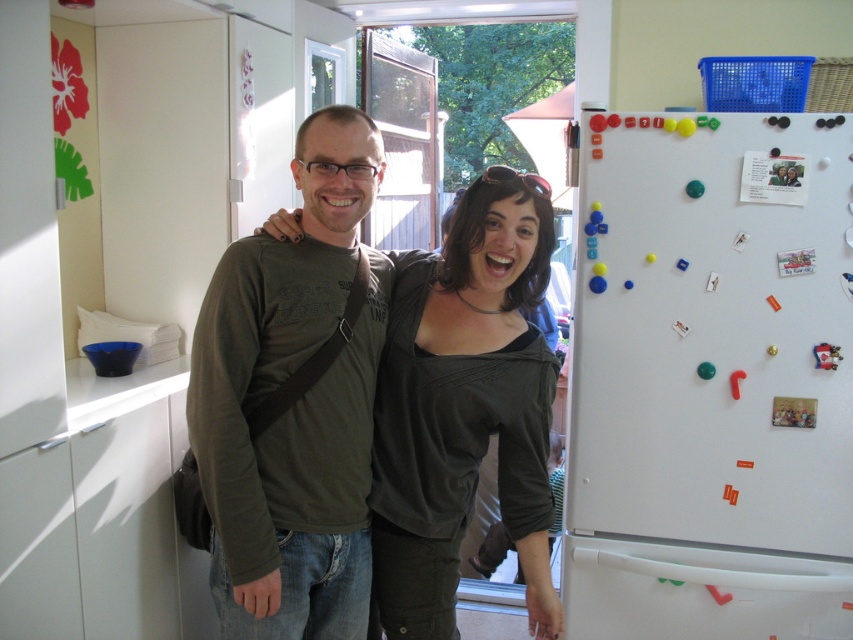
You are trying to locate the white matte refrigerator at right in the kitchen scene. According to the description, where is it positioned relative to the matte olive green shirt at center?

The white matte refrigerator at right is located to the right of the matte olive green shirt at center.

You are trying to locate the matte olive green shirt at center in the kitchen scene. According to the coordinates provided, where exactly is it positioned?

The matte olive green shirt at center is positioned at coordinates point (291,403).